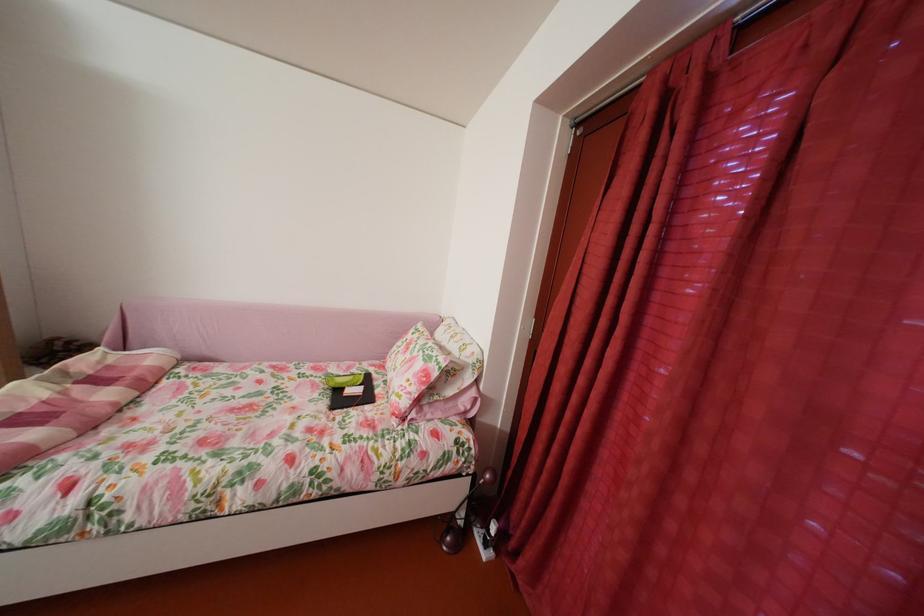
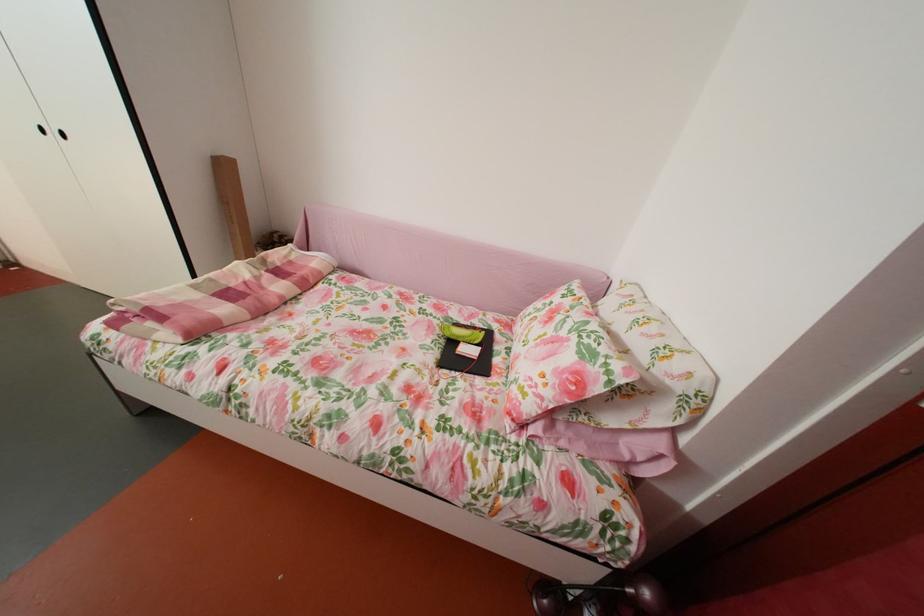
Find the pixel in the second image that matches [354,379] in the first image.

(473, 328)